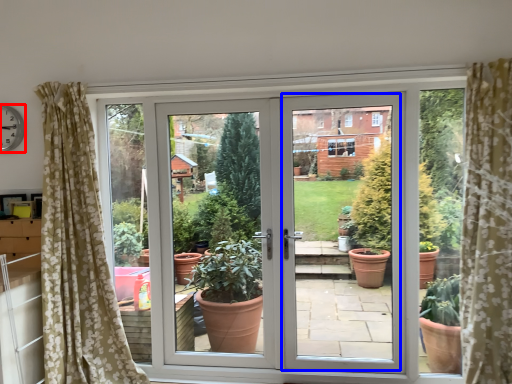
Question: Which object appears farthest to the camera in this image, clock (highlighted by a red box) or screen door (highlighted by a blue box)?

Choices:
 (A) clock
 (B) screen door

Answer: (A)